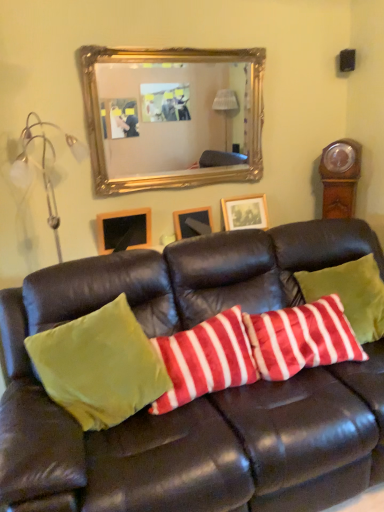
Question: Considering the relative sizes of velvet green couch at center and wooden grandfather clock at right in the image provided, is velvet green couch at center wider than wooden grandfather clock at right?

Choices:
 (A) yes
 (B) no

Answer: (A)

Question: Considering the relative sizes of velvet green couch at center and wooden grandfather clock at right in the image provided, is velvet green couch at center shorter than wooden grandfather clock at right?

Choices:
 (A) no
 (B) yes

Answer: (A)

Question: Can you confirm if velvet green couch at center is thinner than wooden grandfather clock at right?

Choices:
 (A) yes
 (B) no

Answer: (B)

Question: Is velvet green couch at center further to the viewer compared to wooden grandfather clock at right?

Choices:
 (A) yes
 (B) no

Answer: (B)

Question: Is velvet green couch at center looking in the opposite direction of wooden grandfather clock at right?

Choices:
 (A) no
 (B) yes

Answer: (A)

Question: From the image's perspective, is metallic silver lamp at left located above or below wooden picture frame at upper left, the 1th picture frame from the left?

Choices:
 (A) below
 (B) above

Answer: (B)

Question: From a real-world perspective, is metallic silver lamp at left above or below wooden picture frame at upper left, which is the third picture frame in right-to-left order?

Choices:
 (A) above
 (B) below

Answer: (A)

Question: Considering the positions of metallic silver lamp at left and wooden picture frame at upper left, the 1th picture frame from the left, in the image, is metallic silver lamp at left taller or shorter than wooden picture frame at upper left, the 1th picture frame from the left,?

Choices:
 (A) short
 (B) tall

Answer: (B)

Question: Considering the positions of metallic silver lamp at left and wooden picture frame at upper left, which is the third picture frame in right-to-left order, in the image, is metallic silver lamp at left bigger or smaller than wooden picture frame at upper left, which is the third picture frame in right-to-left order,?

Choices:
 (A) big
 (B) small

Answer: (A)

Question: Is point (291, 397) positioned closer to the camera than point (235, 385)?

Choices:
 (A) farther
 (B) closer

Answer: (B)

Question: From a real-world perspective, is velvet green couch at center physically located above or below velvety red and white striped pillow at center, positioned as the 2th pillow in left-to-right order?

Choices:
 (A) below
 (B) above

Answer: (A)

Question: From the image's perspective, is velvet green couch at center above or below velvety red and white striped pillow at center, positioned as the second pillow in right-to-left order?

Choices:
 (A) above
 (B) below

Answer: (B)

Question: In the image, is velvet green couch at center positioned in front of or behind velvety red and white striped pillow at center, positioned as the second pillow in right-to-left order?

Choices:
 (A) front
 (B) behind

Answer: (A)

Question: Would you say metallic silver lamp at left is to the left or to the right of velvet green couch at center in the picture?

Choices:
 (A) left
 (B) right

Answer: (A)

Question: Is metallic silver lamp at left wider or thinner than velvet green couch at center?

Choices:
 (A) thin
 (B) wide

Answer: (A)